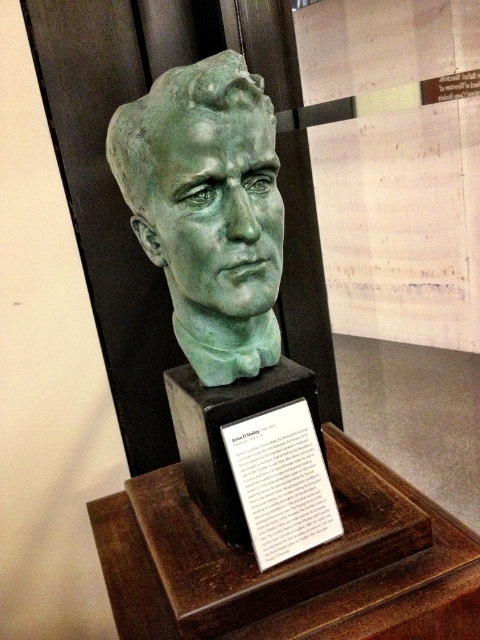
Question: Does green patina bust at center appear over white paper at center?

Choices:
 (A) yes
 (B) no

Answer: (A)

Question: Considering the relative positions of green patina bust at center and white paper at center in the image provided, where is green patina bust at center located with respect to white paper at center?

Choices:
 (A) above
 (B) below

Answer: (A)

Question: Which object is closer to the camera taking this photo?

Choices:
 (A) white paper at center
 (B) green patina bust at center

Answer: (B)

Question: Which object appears farthest from the camera in this image?

Choices:
 (A) green patina bust at center
 (B) white paper at center

Answer: (B)

Question: Does green patina bust at center lie in front of white paper at center?

Choices:
 (A) no
 (B) yes

Answer: (B)